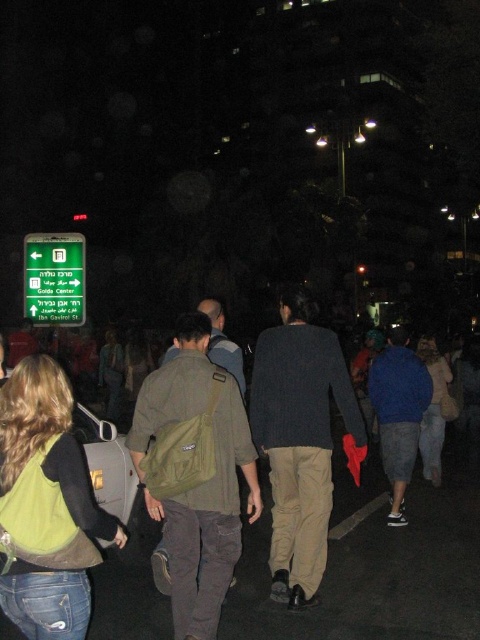
Consider the image. You are a delivery person who needs to place a package on the sidewalk next to the green plastic sign at upper left. The package is as wide as the green fabric backpack at center. Will the package fit next to the sign?

The green fabric backpack at center is wider than the green plastic sign at upper left. Since the package is as wide as the backpack, it may not fit next to the sign because the sign is narrower than the package.

Looking at this image, you are a photographer trying to capture a photo of the green fabric backpack at center and the green plastic sign at upper left. Since both are green, you want to ensure they are distinguishable in your photo. Which object should you focus on to make sure it stands out more in terms of height?

The green plastic sign at upper left is taller than the green fabric backpack at center, so focusing on the green plastic sign at upper left would make it stand out more in terms of height.

You are standing at the camera position observing the scene. There is a khaki pants at center located at point (300,440). What is the position of the khaki pants at center relative to the person in green jacket and beige backpack?

The khaki pants at center is located at point (300,440), which is the center of the image. The person in green jacket and beige backpack is positioned in the foreground, so the khaki pants at center is behind the person in green jacket and beige backpack.